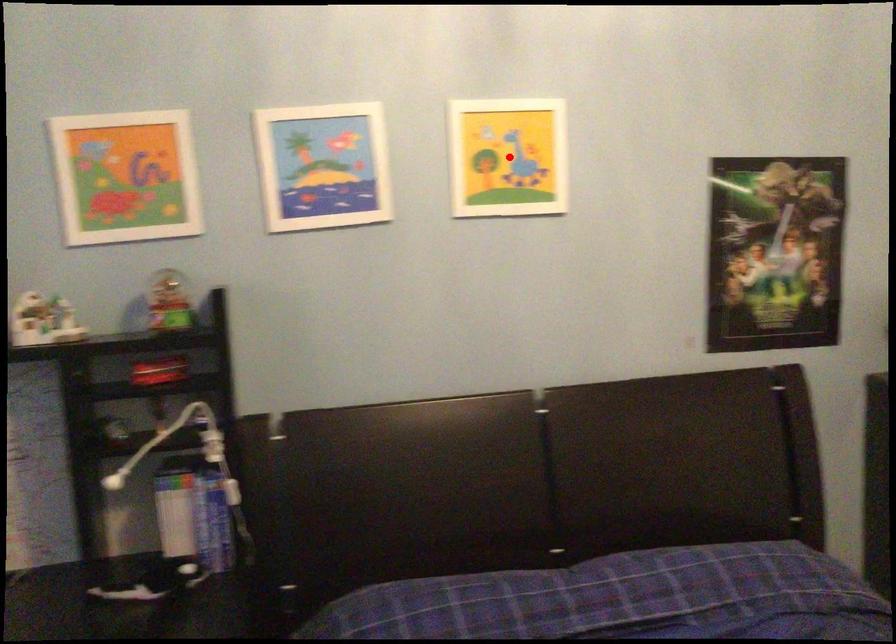
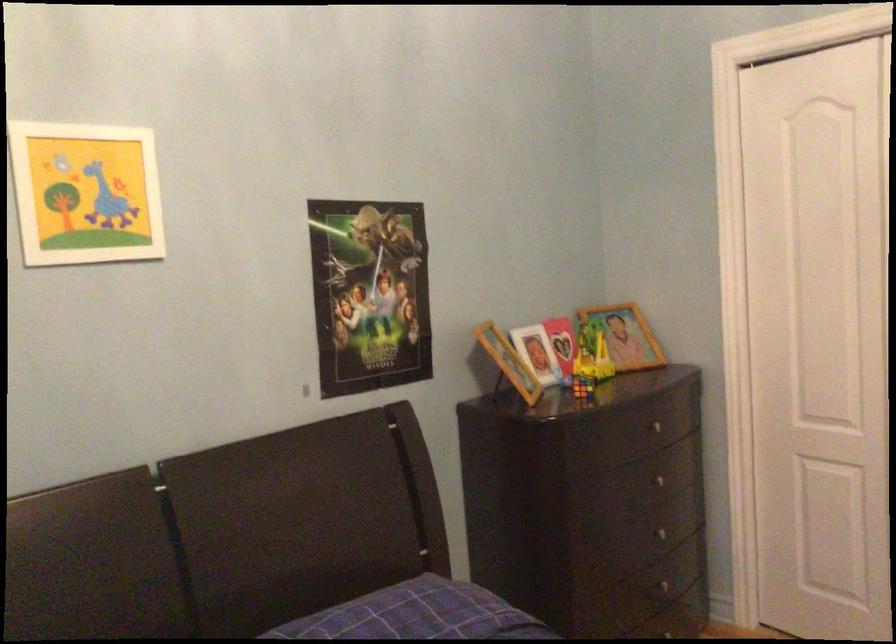
Question: I am providing you with two images of the same scene from different viewpoints. A red point is shown in image1. For the corresponding object point in image2, is it positioned nearer or farther from the camera?

Choices:
 (A) Nearer
 (B) Farther

Answer: (A)